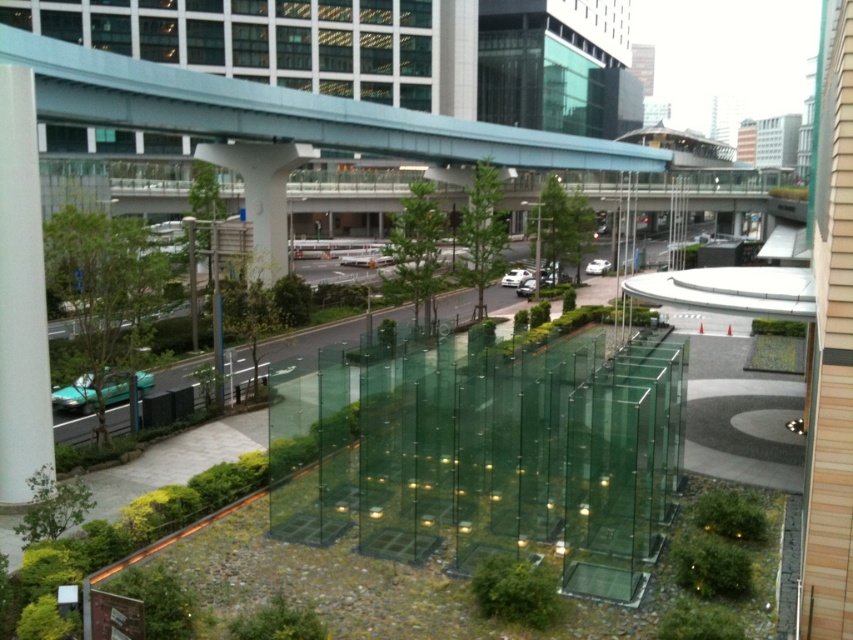
You are a painter standing on the sidewalk and want to capture both the transparent glass window at upper center and the white smooth pillar at left in your painting. Which object should you focus on first if you want to paint them in the correct size relationship?

You should focus on painting the transparent glass window at upper center first because it is much taller than the white smooth pillar at left, so its size relationship needs to be accurately depicted first to maintain proportion in the painting.

You are a city planner assessing the urban layout. You need to install a new bench that is 2 meters wide. The bench must be placed between the transparent glass window at upper center and the white smooth pillar at left. Based on the space between them, will the bench fit?

The transparent glass window at upper center is wider than the white smooth pillar at left. However, the question is about the space between them, not their individual widths. Since the description only provides information about their widths relative to each other and not the distance between them, it is impossible to determine if the 2 meter wide bench will fit in the space between them based on the given information.

You are standing at the point marked as point [259,38] in the urban scene. What object are you currently on?

The point [259,38] is on the transparent glass window at upper center.